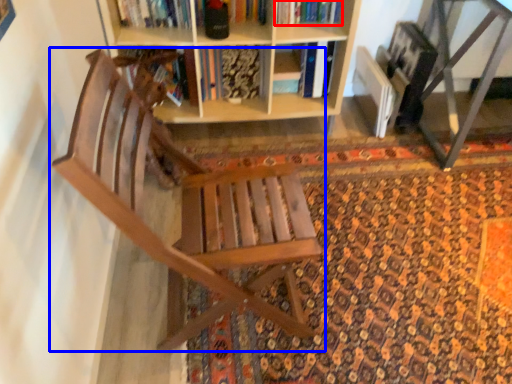
Question: Which of the following is the farthest to the observer, book (highlighted by a red box) or chair (highlighted by a blue box)?

Choices:
 (A) book
 (B) chair

Answer: (A)